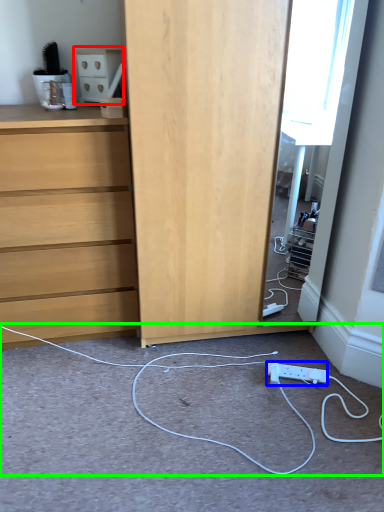
Question: Based on their relative distances, which object is farther from cabinetry (highlighted by a red box)? Choose from electric outlet (highlighted by a blue box) and string (highlighted by a green box).

Choices:
 (A) electric outlet
 (B) string

Answer: (A)